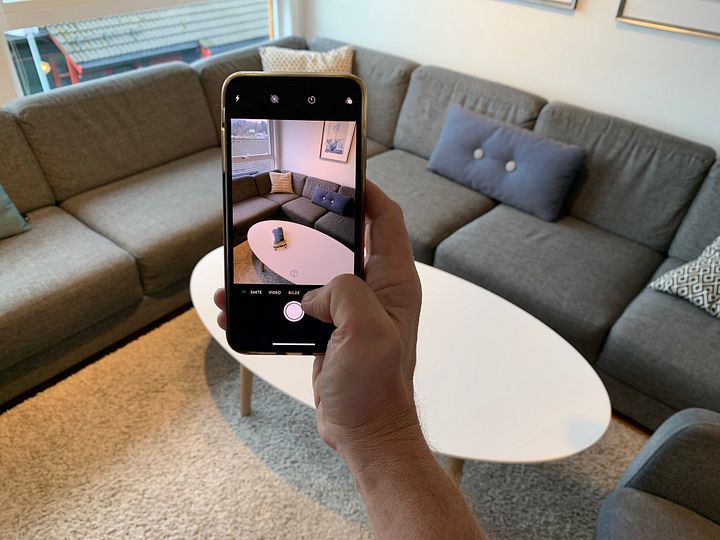
What are the coordinates of `blue pillow` in the screenshot? It's located at (553, 174).